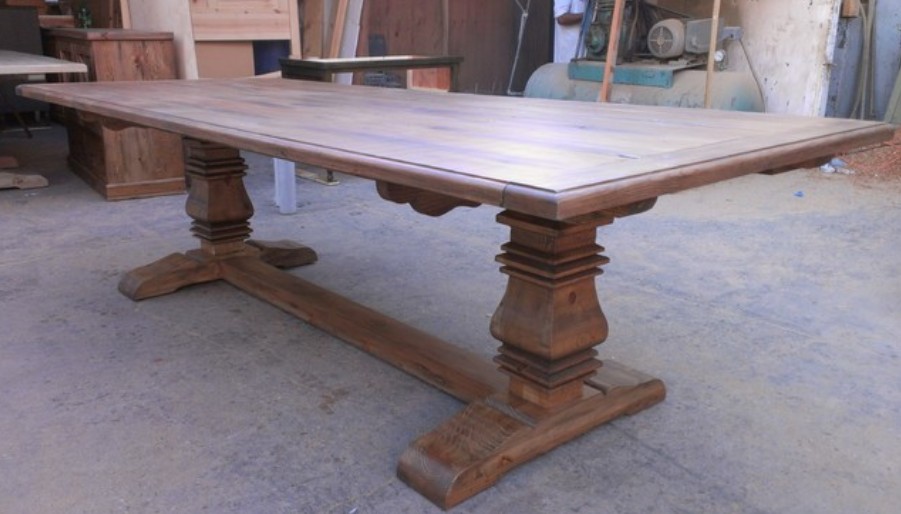
Identify the location of tan fan. (663, 40).